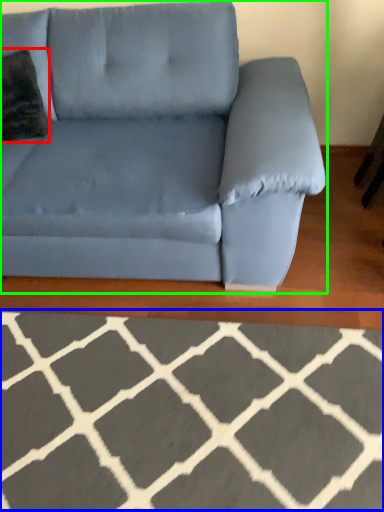
Question: Considering the real-world distances, which object is farthest from throw pillow (highlighted by a red box)? furniture (highlighted by a blue box) or studio couch (highlighted by a green box)?

Choices:
 (A) furniture
 (B) studio couch

Answer: (A)